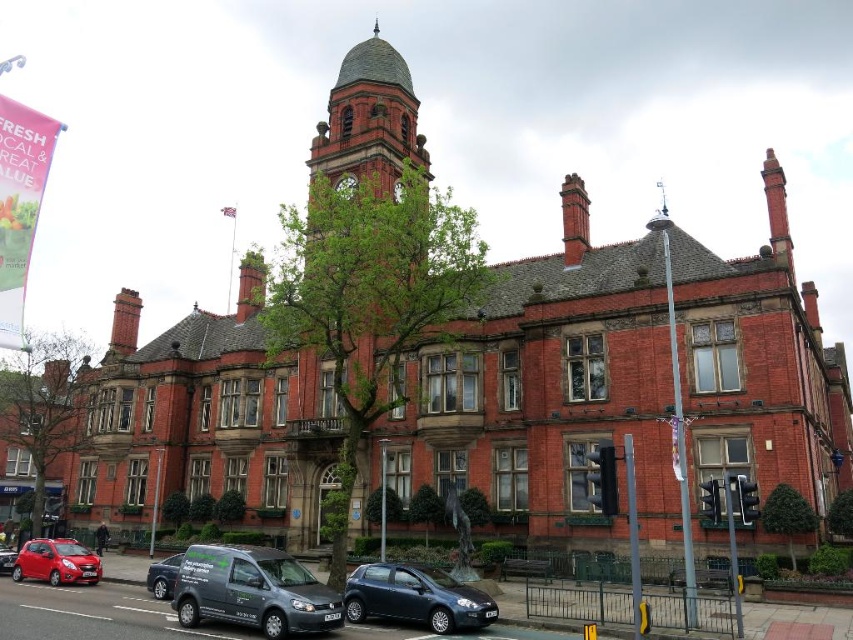
Question: Does metallic blue hatchback at lower center have a smaller size compared to shiny red car at lower left?

Choices:
 (A) yes
 (B) no

Answer: (A)

Question: Does red brick clock tower at center have a lesser width compared to metallic blue hatchback at lower center?

Choices:
 (A) no
 (B) yes

Answer: (A)

Question: Does red brick clock tower at center appear on the right side of metallic blue hatchback at lower center?

Choices:
 (A) no
 (B) yes

Answer: (A)

Question: Which object is the closest to the shiny red car at lower left?

Choices:
 (A) metallic blue hatchback at lower center
 (B) red brick clock tower at center
 (C) matte black van at lower left

Answer: (C)

Question: Based on their relative distances, which object is farther from the shiny red car at lower left?

Choices:
 (A) matte red car at lower left
 (B) matte gray van at lower center

Answer: (B)

Question: Which object is the closest to the matte red car at lower left?

Choices:
 (A) red brick clock tower at center
 (B) shiny red car at lower left
 (C) metallic blue hatchback at lower center
 (D) matte black van at lower left

Answer: (B)